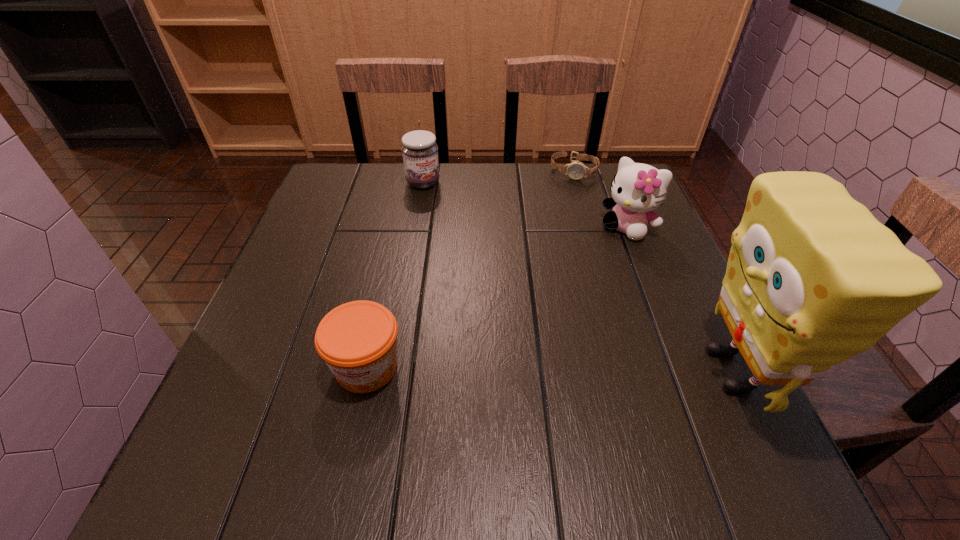
I want to click on the nearer jam, so (358, 340).

The image size is (960, 540). I want to click on the fourth tallest object, so click(x=358, y=340).

Locate an element on the screen. This screenshot has height=540, width=960. the tallest object is located at coordinates (813, 278).

Find the location of `the fourth shortest object`. the fourth shortest object is located at coordinates (637, 189).

Where is `the third nearest object`? Image resolution: width=960 pixels, height=540 pixels. the third nearest object is located at coordinates (637, 189).

I want to click on watch, so click(576, 170).

Locate an element on the screen. This screenshot has height=540, width=960. the third shortest object is located at coordinates (420, 152).

Identify the location of the taller jam. This screenshot has width=960, height=540. (420, 152).

The width and height of the screenshot is (960, 540). What are the coordinates of `free location located on the front label of the fourth tallest object` in the screenshot? It's located at (353, 428).

Where is `vacant space located 0.400m on the face of the tallest object`? vacant space located 0.400m on the face of the tallest object is located at coordinates (472, 370).